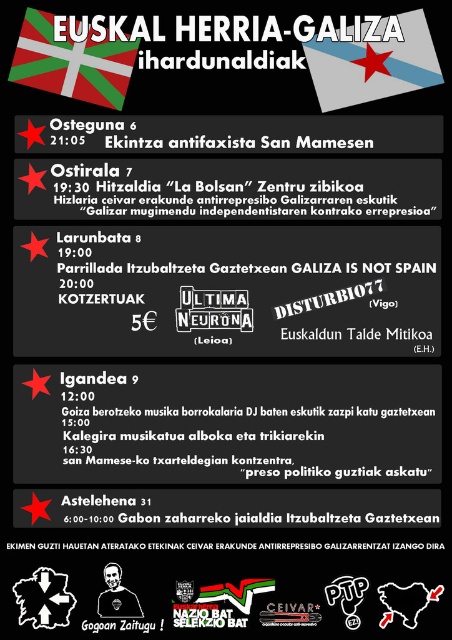
Does blue fabric flag at upper center have a lesser width compared to white fabric flag at upper left?

Incorrect, blue fabric flag at upper center's width is not less than white fabric flag at upper left's.

Which is more to the left, blue fabric flag at upper center or white fabric flag at upper left?

white fabric flag at upper left

Between point (433, 81) and point (99, 84), which one is positioned in front?

Point (433, 81) is more forward.

Where is `blue fabric flag at upper center`? blue fabric flag at upper center is located at coordinates (373, 65).

In the scene shown: Who is positioned more to the right, black paper at center or white fabric flag at upper left?

black paper at center

Which is below, black paper at center or white fabric flag at upper left?

black paper at center

Where is `black paper at center`? Image resolution: width=452 pixels, height=640 pixels. black paper at center is located at coordinates (227, 188).

At what (x,y) coordinates should I click in order to perform the action: click on black paper at center. Please return your answer as a coordinate pair (x, y). Image resolution: width=452 pixels, height=640 pixels. Looking at the image, I should click on (227, 188).

This screenshot has width=452, height=640. In order to click on black paper at center in this screenshot , I will do `click(227, 188)`.

From the picture: Is black paper at center below blue fabric flag at upper center?

Yes.

Which is behind, point (51, 161) or point (418, 45)?

The point (51, 161) is more distant.

Where is `black paper at center`? The width and height of the screenshot is (452, 640). black paper at center is located at coordinates (227, 188).